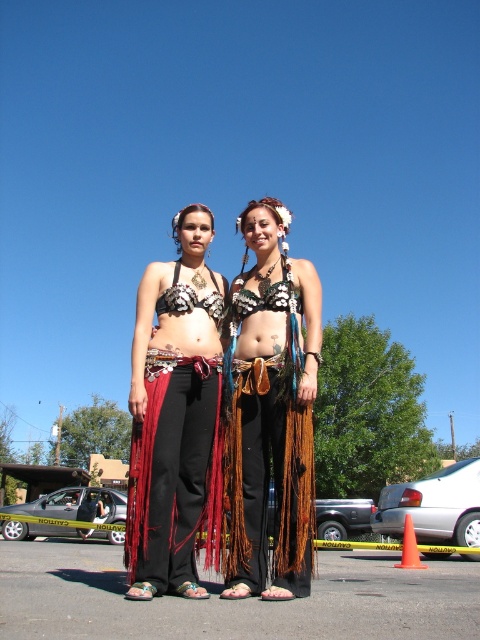
You are a costume designer preparing to adjust the fit of the costumes for a performance. You notice two accessories at the center of the image, the black leather sandals at center and the brown leather belt at center. Which accessory requires more space horizontally to accommodate adjustments?

The black leather sandals at center might be wider than brown leather belt at center, so they require more horizontal space for adjustments.

You are taking a photo of two people in the scene. You want to focus on the point closer to the camera. Which point should you choose between point (276, 518) and point (224, 314)?

Point (276, 518) is closer to the camera than point (224, 314), so you should choose point (276, 518) to focus on.